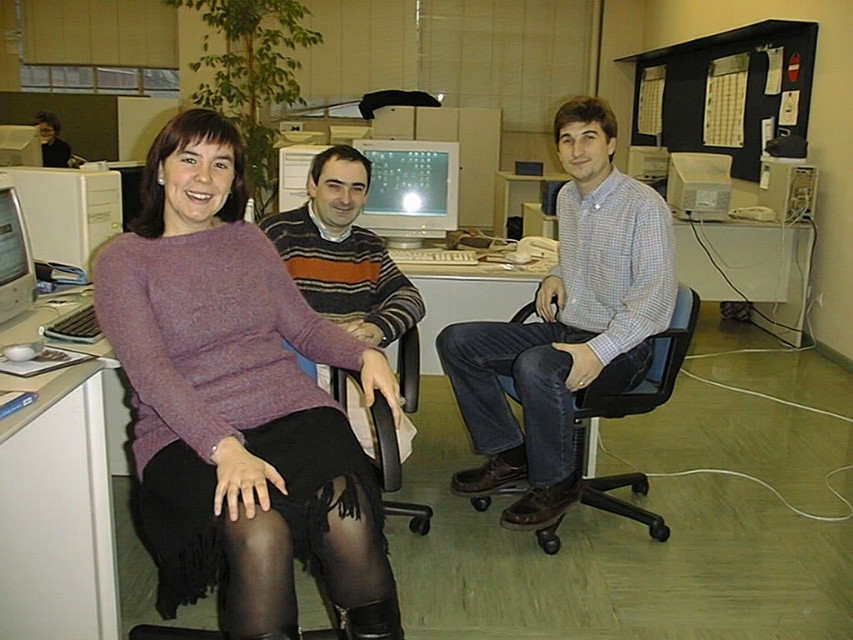
Question: Can you confirm if black tights at lower left is thinner than matte plastic monitor at center?

Choices:
 (A) no
 (B) yes

Answer: (A)

Question: Is black tights at lower left bigger than striped sweater at center?

Choices:
 (A) yes
 (B) no

Answer: (B)

Question: Which object is closer to the camera taking this photo?

Choices:
 (A) white plastic desktop computer at left
 (B) black tights at lower left

Answer: (B)

Question: Which point is farther to the camera?

Choices:
 (A) (102, 243)
 (B) (241, 596)
 (C) (219, 168)

Answer: (A)

Question: Is matte plastic monitor at center above matte white monitor at left?

Choices:
 (A) no
 (B) yes

Answer: (B)

Question: Considering the real-world distances, which object is farthest from the white plastic desktop computer at left?

Choices:
 (A) checkered fabric shirt at center
 (B) black tights at lower left

Answer: (B)